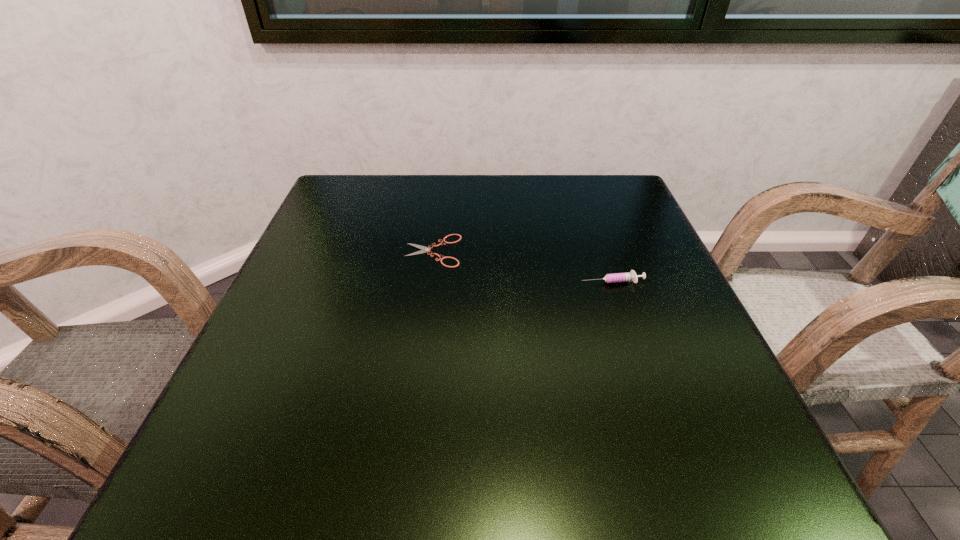
The height and width of the screenshot is (540, 960). I want to click on syringe, so click(x=628, y=276).

You are a GUI agent. You are given a task and a screenshot of the screen. Output one action in this format:
    pyautogui.click(x=<x>, y=<y>)
    Task: Click on the nearer object
    Image resolution: width=960 pixels, height=540 pixels.
    Given the screenshot: What is the action you would take?
    pyautogui.click(x=628, y=276)

The image size is (960, 540). Find the location of `shears`. shears is located at coordinates click(x=424, y=249).

Where is `the left object`? This screenshot has width=960, height=540. the left object is located at coordinates (424, 249).

The image size is (960, 540). I want to click on free spot located 0.200m on the left of the taller object, so click(476, 281).

Image resolution: width=960 pixels, height=540 pixels. What are the coordinates of `vacant space situated 0.110m on the right of the shorter object` in the screenshot? It's located at (514, 251).

Locate an element on the screen. object that is positioned at the right edge is located at coordinates (628, 276).

In the image, there is a desktop. Find the location of `free space at the far edge`. free space at the far edge is located at coordinates (548, 178).

Find the location of a particular element. Image resolution: width=960 pixels, height=540 pixels. free region at the near edge of the desktop is located at coordinates (499, 464).

This screenshot has height=540, width=960. In order to click on vacant area at the left edge in this screenshot , I will do `click(317, 280)`.